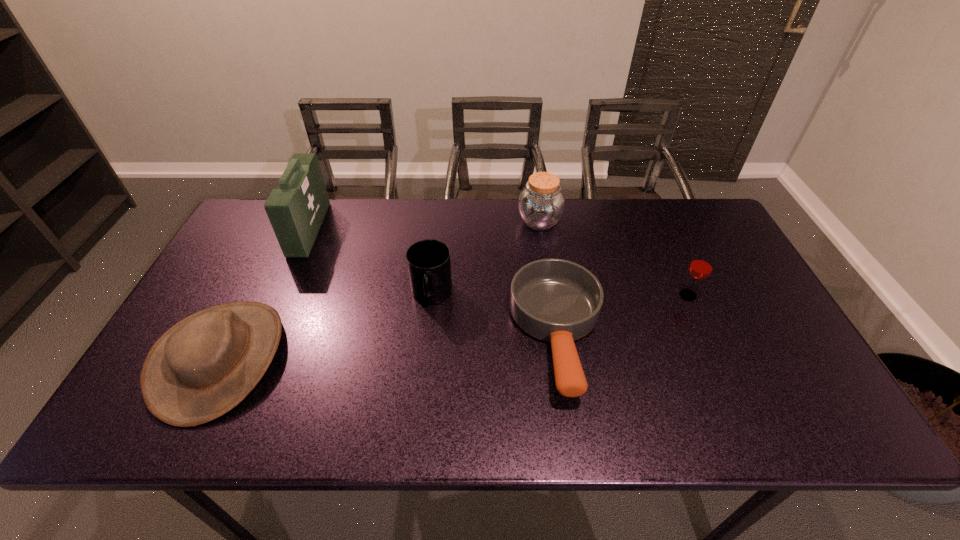
The height and width of the screenshot is (540, 960). Identify the location of vacant position located 0.250m on the back of the cowboy hat. (277, 243).

Image resolution: width=960 pixels, height=540 pixels. Identify the location of vacant region located on the handle side of the pan. (572, 431).

Identify the location of the first-aid kit that is at the far edge. (296, 209).

You are a GUI agent. You are given a task and a screenshot of the screen. Output one action in this format:
    pyautogui.click(x=<x>, y=<y>)
    Task: Click on the jar present at the far edge
    
    Given the screenshot: What is the action you would take?
    pyautogui.click(x=541, y=204)

This screenshot has width=960, height=540. Identify the location of cowboy hat situated at the near edge. (202, 367).

This screenshot has width=960, height=540. I want to click on pan present at the near edge, so click(555, 300).

Find the location of `object located in the left edge section of the desktop`. object located in the left edge section of the desktop is located at coordinates (202, 367).

This screenshot has height=540, width=960. In order to click on object present at the near left corner in this screenshot , I will do `click(202, 367)`.

This screenshot has width=960, height=540. In the image, there is a desktop. Identify the location of vacant area at the far edge. (355, 212).

Identify the location of vacant point at the near edge. (376, 405).